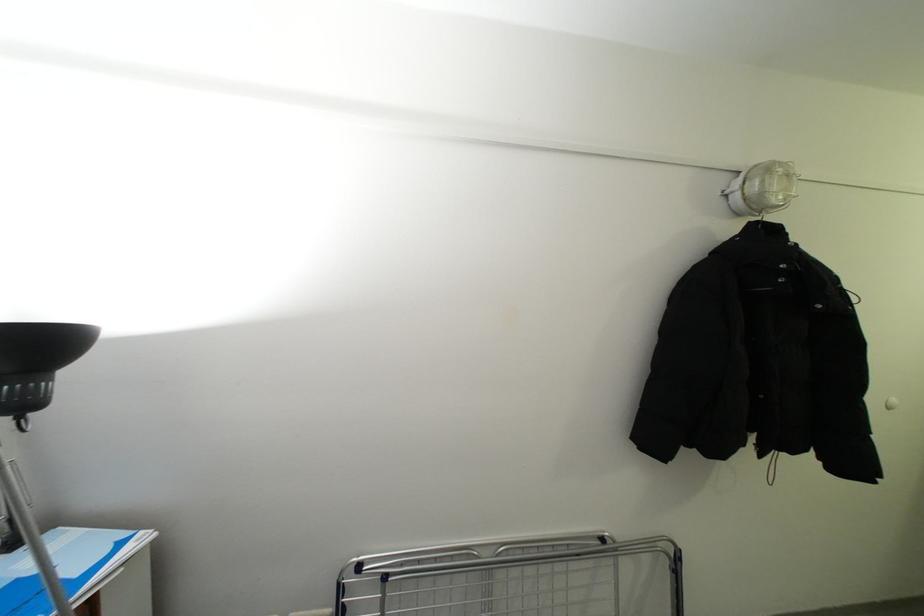
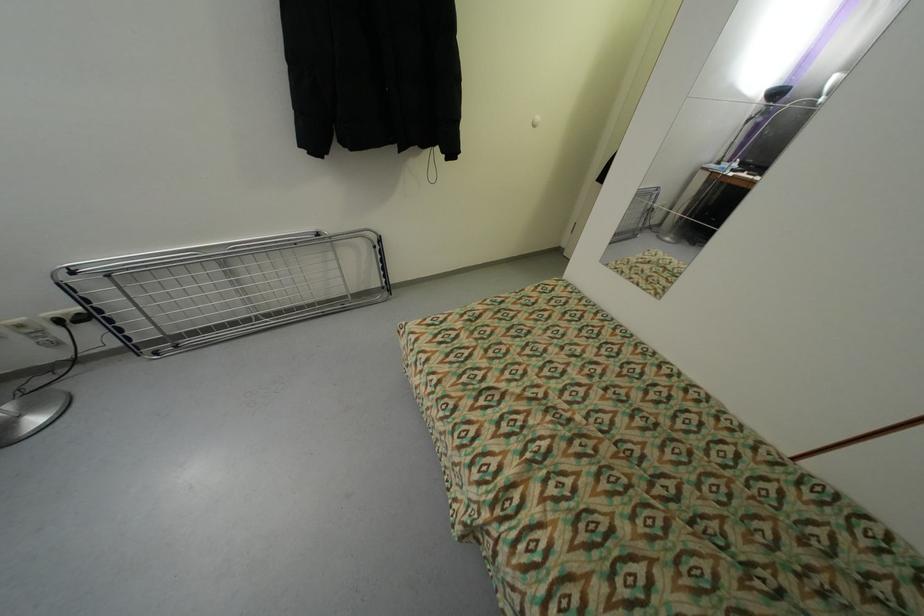
In the second image, find the point that corresponds to pixel 857 466 in the first image.

(457, 152)